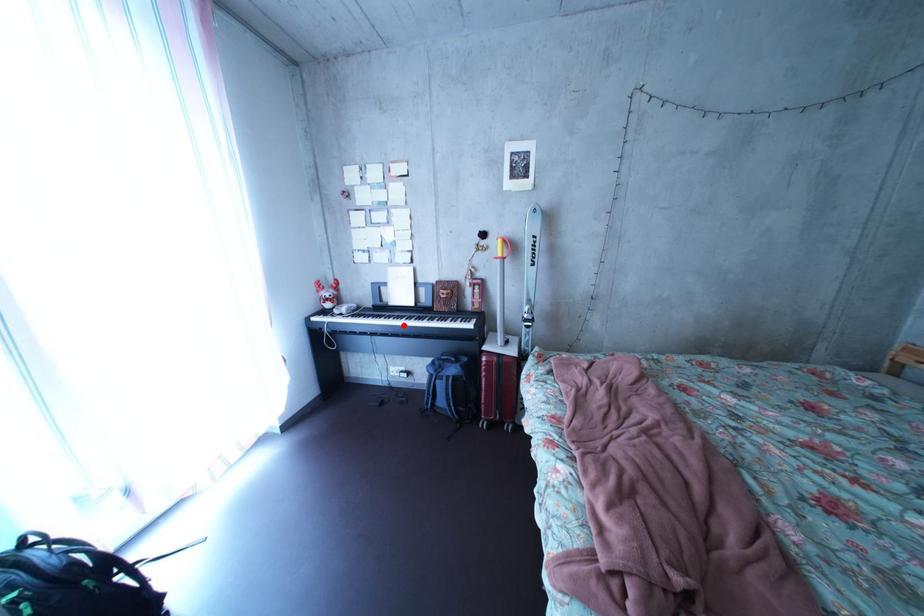
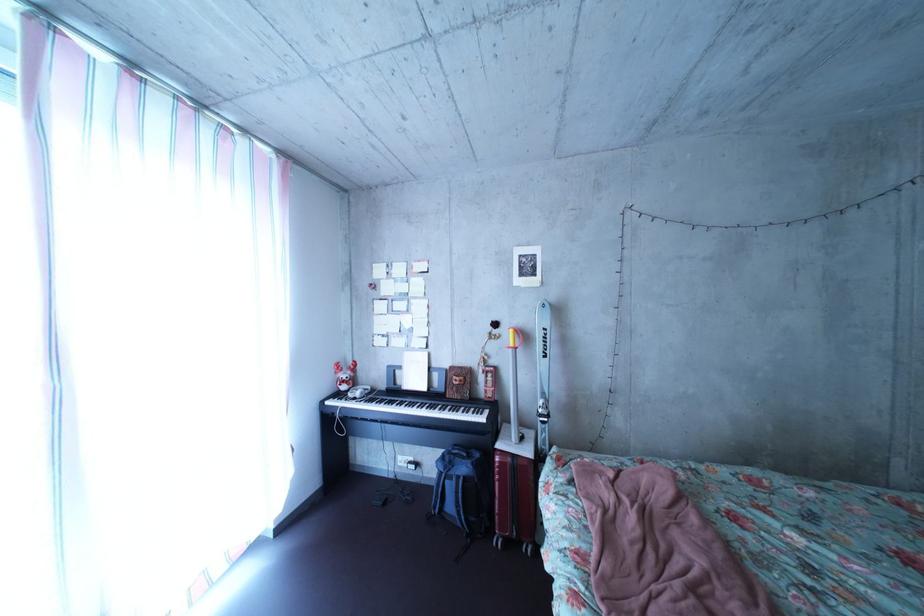
Find the pixel in the second image that matches the highlighted location in the first image.

(416, 411)